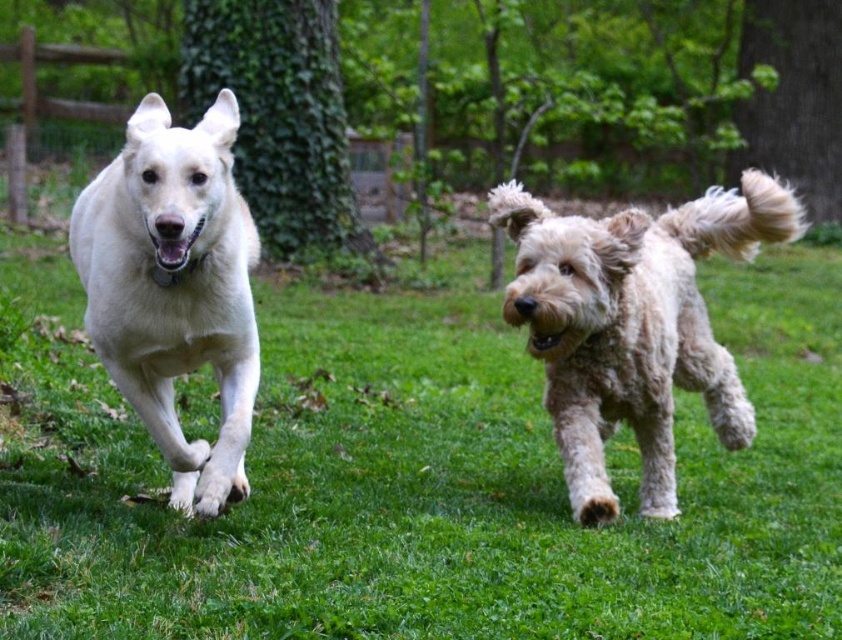
Can you confirm if green grass at center is taller than fuzzy beige dog at right?

Yes.

Does point (822, 525) come in front of point (601, 252)?

No.

Find the location of `green grass at center`. green grass at center is located at coordinates [x=441, y=486].

In the scene shown: Is fuzzy beige dog at right in front of white fluffy dog at left?

No.

Consider the image. Does fuzzy beige dog at right have a greater width compared to white fluffy dog at left?

Yes.

Locate an element on the screen. This screenshot has width=842, height=640. fuzzy beige dog at right is located at coordinates (632, 324).

Consider the image. Is green grass at center to the right of white fluffy dog at left from the viewer's perspective?

Indeed, green grass at center is positioned on the right side of white fluffy dog at left.

I want to click on green grass at center, so click(441, 486).